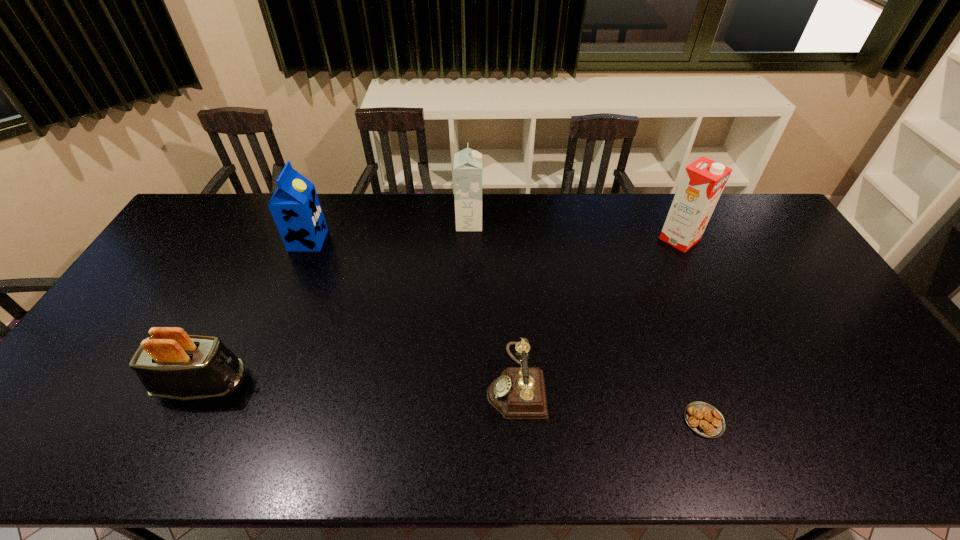
At what (x,y) coordinates should I click in order to perform the action: click on vacant point that satisfies the following two spatial constraints: 1. with the cap open on the leftmost carton; 2. on the left side of the pastry. Please return your answer as a coordinate pair (x, y). This screenshot has height=540, width=960. Looking at the image, I should click on (234, 421).